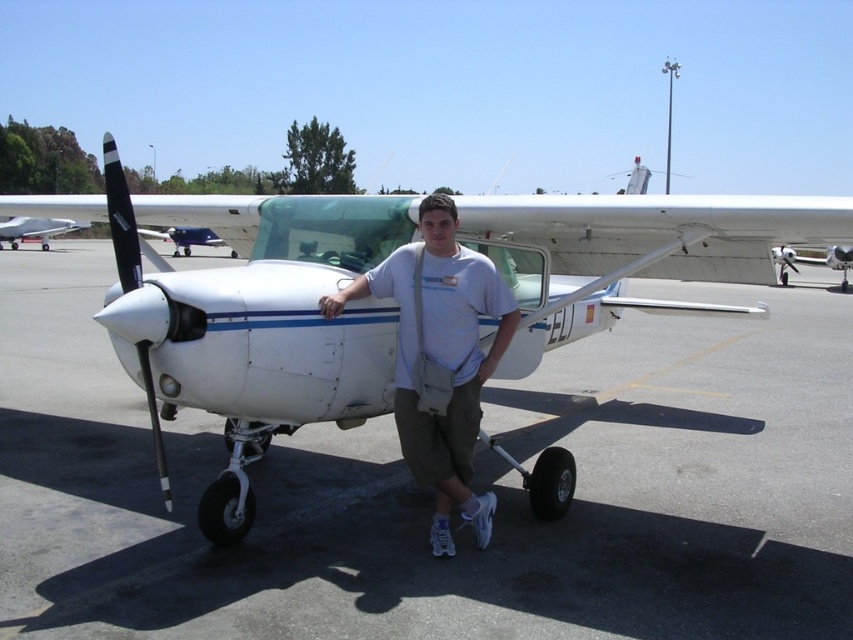
Who is more distant from viewer, (24, 196) or (404, 388)?

Positioned behind is point (24, 196).

Based on the photo, who is positioned more to the right, white matte airplane at center or white cotton t-shirt at center?

white matte airplane at center

Find the location of a particular element. The image size is (853, 640). white matte airplane at center is located at coordinates (250, 321).

How much distance is there between white matte airplane at center and white glossy airplane at left?

They are 30.67 meters apart.

Where is `white matte airplane at center`? This screenshot has height=640, width=853. white matte airplane at center is located at coordinates (250, 321).

Is white cotton t-shirt at center below white glossy airplane at left?

Correct, white cotton t-shirt at center is located below white glossy airplane at left.

Can you confirm if white cotton t-shirt at center is taller than white glossy airplane at left?

In fact, white cotton t-shirt at center may be shorter than white glossy airplane at left.

This screenshot has height=640, width=853. Identify the location of white cotton t-shirt at center. (440, 356).

You are a GUI agent. You are given a task and a screenshot of the screen. Output one action in this format:
    pyautogui.click(x=<x>, y=<y>)
    Task: Click on the white cotton t-shirt at center
    The width and height of the screenshot is (853, 640).
    Given the screenshot: What is the action you would take?
    pyautogui.click(x=440, y=356)